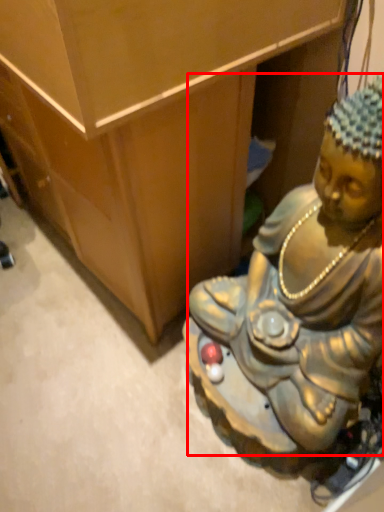
Question: Where is person (annotated by the red box) located in relation to furniture in the image?

Choices:
 (A) right
 (B) left

Answer: (A)